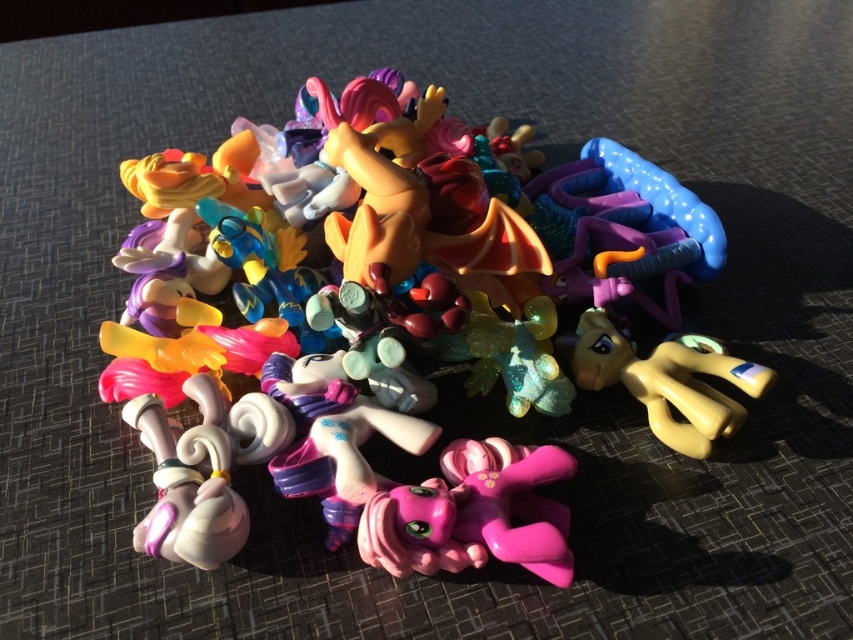
Question: Can you confirm if glossy plastic pony at center is positioned to the left of matte yellow pony at center?

Choices:
 (A) yes
 (B) no

Answer: (A)

Question: Does glossy plastic pony at center have a larger size compared to matte yellow pony at center?

Choices:
 (A) yes
 (B) no

Answer: (A)

Question: Among these points, which one is farthest from the camera?

Choices:
 (A) (648, 381)
 (B) (215, 252)

Answer: (B)

Question: Which point appears farthest from the camera in this image?

Choices:
 (A) (624, 236)
 (B) (671, 381)

Answer: (A)

Question: Observing the image, what is the correct spatial positioning of glossy plastic pony at center in reference to matte yellow pony at center?

Choices:
 (A) below
 (B) above

Answer: (B)